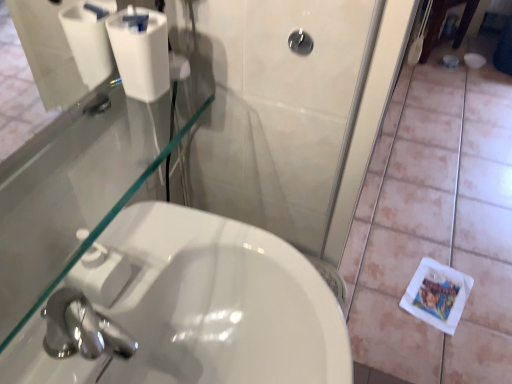
Question: Can you confirm if white matte toilet paper at upper left is wider than white glossy sink at lower left?

Choices:
 (A) yes
 (B) no

Answer: (B)

Question: Can you confirm if white matte toilet paper at upper left is bigger than white glossy sink at lower left?

Choices:
 (A) yes
 (B) no

Answer: (B)

Question: From a real-world perspective, is white matte toilet paper at upper left positioned under white glossy sink at lower left based on gravity?

Choices:
 (A) no
 (B) yes

Answer: (A)

Question: Can you confirm if white matte toilet paper at upper left is smaller than white glossy sink at lower left?

Choices:
 (A) no
 (B) yes

Answer: (B)

Question: Are white matte toilet paper at upper left and white glossy sink at lower left located far from each other?

Choices:
 (A) no
 (B) yes

Answer: (A)

Question: Considering the positions of white matte toilet paper at upper left and black glossy showerhead at upper center in the image, is white matte toilet paper at upper left taller or shorter than black glossy showerhead at upper center?

Choices:
 (A) tall
 (B) short

Answer: (A)

Question: From the image's perspective, is white matte toilet paper at upper left located above or below black glossy showerhead at upper center?

Choices:
 (A) above
 (B) below

Answer: (B)

Question: Would you say white matte toilet paper at upper left is inside or outside black glossy showerhead at upper center?

Choices:
 (A) outside
 (B) inside

Answer: (A)

Question: Considering their positions, is white matte toilet paper at upper left located in front of or behind black glossy showerhead at upper center?

Choices:
 (A) behind
 (B) front

Answer: (B)

Question: Would you say black glossy showerhead at upper center is inside or outside white matte toilet paper at upper left?

Choices:
 (A) inside
 (B) outside

Answer: (B)

Question: Considering the relative positions of black glossy showerhead at upper center and white matte toilet paper at upper left in the image provided, is black glossy showerhead at upper center to the left or to the right of white matte toilet paper at upper left?

Choices:
 (A) right
 (B) left

Answer: (A)

Question: From a real-world perspective, is black glossy showerhead at upper center positioned above or below white matte toilet paper at upper left?

Choices:
 (A) above
 (B) below

Answer: (B)

Question: Looking at their shapes, would you say black glossy showerhead at upper center is wider or thinner than white matte toilet paper at upper left?

Choices:
 (A) wide
 (B) thin

Answer: (B)

Question: Looking at the image, does white matte tile at lower right seem bigger or smaller compared to white matte toilet paper at upper left?

Choices:
 (A) big
 (B) small

Answer: (A)

Question: Is point (490, 92) positioned closer to the camera than point (140, 48)?

Choices:
 (A) closer
 (B) farther

Answer: (B)